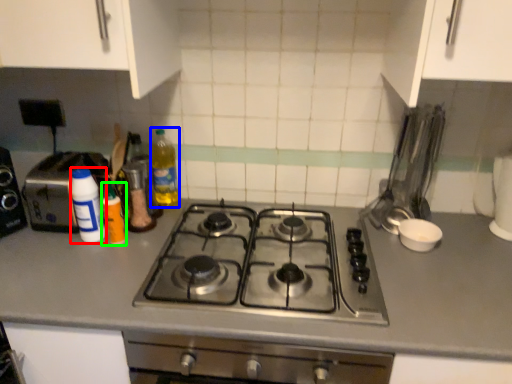
Question: Based on their relative distances, which object is farther from bottle (highlighted by a red box)? Choose from bottle (highlighted by a blue box) and bottle (highlighted by a green box).

Choices:
 (A) bottle
 (B) bottle

Answer: (A)